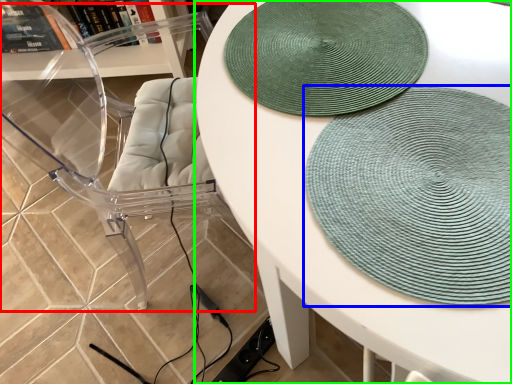
Question: Which object is the closest to the swivel chair (highlighted by a red box)? Choose among these: mat (highlighted by a blue box) or table (highlighted by a green box).

Choices:
 (A) mat
 (B) table

Answer: (B)